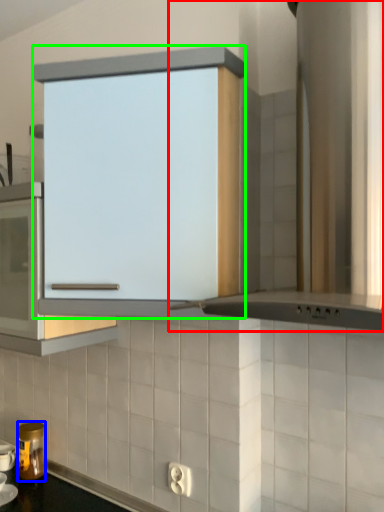
Question: Based on their relative distances, which object is farther from home appliance (highlighted by a red box)? Choose from kitchen appliance (highlighted by a blue box) and cabinetry (highlighted by a green box).

Choices:
 (A) kitchen appliance
 (B) cabinetry

Answer: (A)